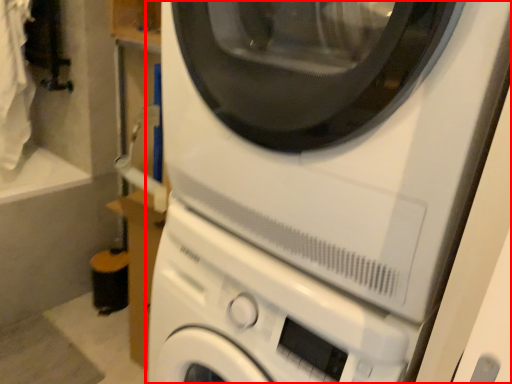
Question: From the image's perspective, what is the correct spatial positioning of washing machine (annotated by the red box) in reference to washing machine?

Choices:
 (A) above
 (B) below

Answer: (A)